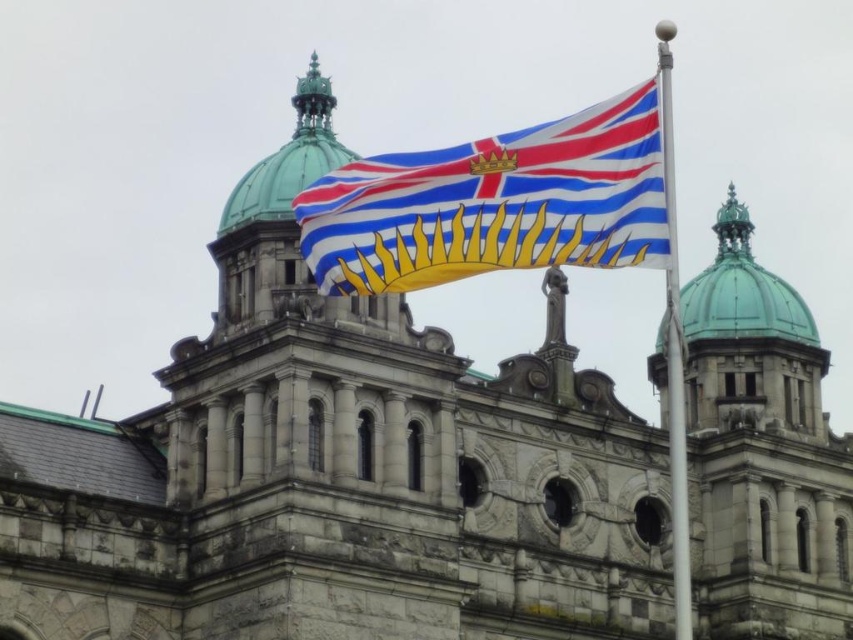
Question: Among these objects, which one is farthest from the camera?

Choices:
 (A) polyester flag at center
 (B) polished silver pole at upper right

Answer: (A)

Question: Is polyester flag at center positioned before polished silver pole at upper right?

Choices:
 (A) no
 (B) yes

Answer: (A)

Question: Does polyester flag at center appear under polished silver pole at upper right?

Choices:
 (A) no
 (B) yes

Answer: (A)

Question: Can you confirm if polyester flag at center is bigger than polished silver pole at upper right?

Choices:
 (A) yes
 (B) no

Answer: (B)

Question: Which point appears closest to the camera in this image?

Choices:
 (A) (415, 198)
 (B) (668, 323)

Answer: (B)

Question: Which of the following is the closest to the observer?

Choices:
 (A) (672, 400)
 (B) (599, 141)

Answer: (B)